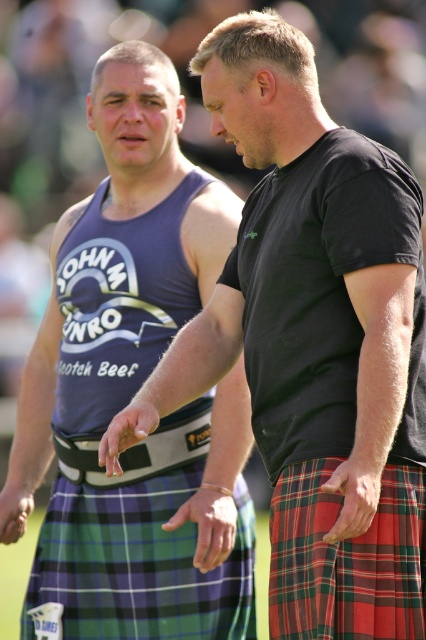
You are a photographer at the event and need to position two men with their kilts so that both are visible in the frame. Given that the green plaid kilt at center and the red plaid kilt at center have different sizes, which kilt should you place closer to the camera to ensure both are equally visible in the photo?

The green plaid kilt at center is bigger than the red plaid kilt at center. To make both equally visible, place the smaller red plaid kilt at center closer to the camera and the larger green plaid kilt at center further back.

You are a photographer standing at the camera position. You want to take a photo of the two men in the scene. However, there is a tripod placed at point (207,228). The tripod is 1.5 meters tall. Will the tripod be visible in your photo if you are using a camera with a standard lens that has a 50mm focal length?

The tripod at point (207,228) is 5.23 meters away from the camera. Since the tripod is 1.5 meters tall and the camera is positioned at a standard 50mm focal length, the tripod will likely be visible in the photo as it is within the camera lens range and not obstructed by other objects. However, exact visibility may depend on the camera angle and composition.

You are a photographer setting up for an event. You need to ensure that the matte black tank top at left and the red plaid kilt at center are both visible in your shot. Given their sizes, which object might require more space in the frame to capture fully?

The matte black tank top at left has a larger width than the red plaid kilt at center, so it would require more space in the frame to capture fully.